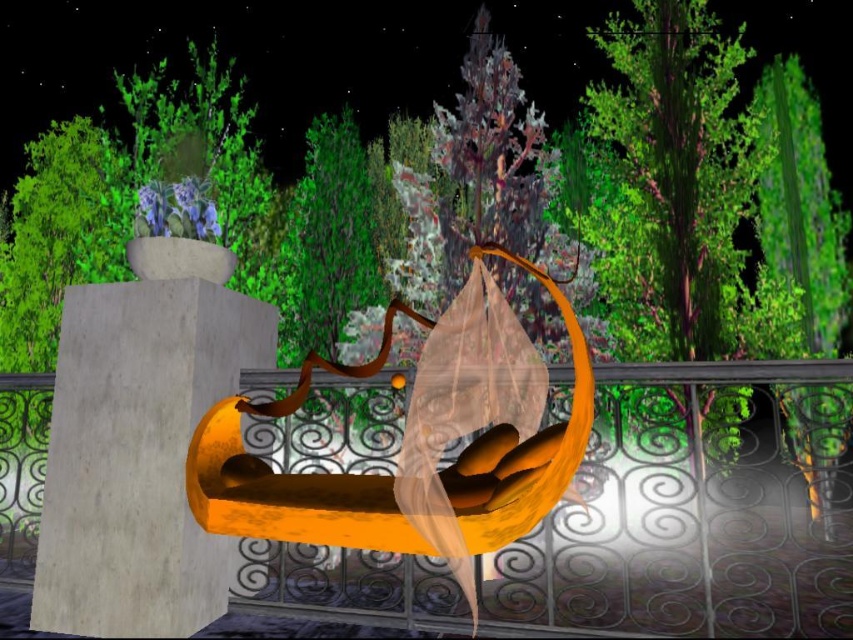
Is metallic wrought iron at center shorter than concrete block at center?

No.

Identify the location of metallic wrought iron at center. (698, 508).

Does point (769, 477) come behind point (213, 449)?

Yes.

Is metallic wrought iron at center above orange matte bench at center?

Incorrect, metallic wrought iron at center is not positioned above orange matte bench at center.

Is point (598, 483) closer to camera compared to point (258, 497)?

That is False.

Locate an element on the screen. Image resolution: width=853 pixels, height=640 pixels. metallic wrought iron at center is located at coordinates pyautogui.click(x=698, y=508).

Can you confirm if concrete block at center is shorter than orange matte bench at center?

No, concrete block at center is not shorter than orange matte bench at center.

Is point (141, 374) positioned in front of point (299, 502)?

No, (141, 374) is further to viewer.

Image resolution: width=853 pixels, height=640 pixels. Identify the location of concrete block at center. (138, 456).